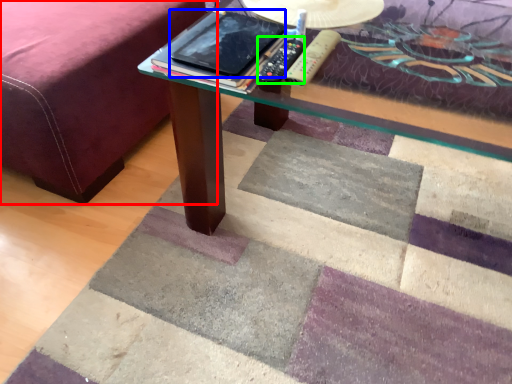
Question: Considering the real-world distances, which object is closest to bed frame (highlighted by a red box)? tablet computer (highlighted by a blue box) or remote (highlighted by a green box).

Choices:
 (A) tablet computer
 (B) remote

Answer: (A)